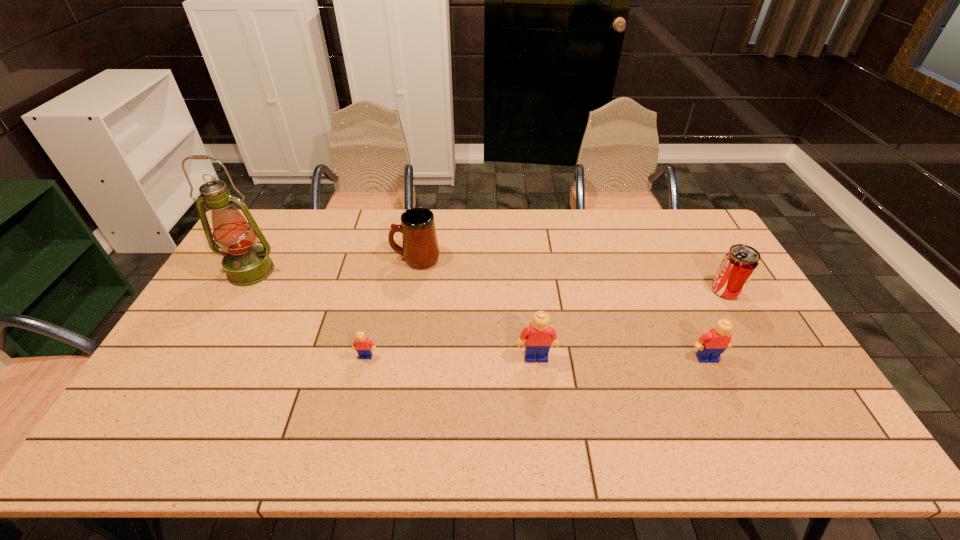
The height and width of the screenshot is (540, 960). In order to click on free location that satisfies the following two spatial constraints: 1. on the side of the mug with the handle; 2. on the face of the shortest object in this screenshot , I will do `click(400, 356)`.